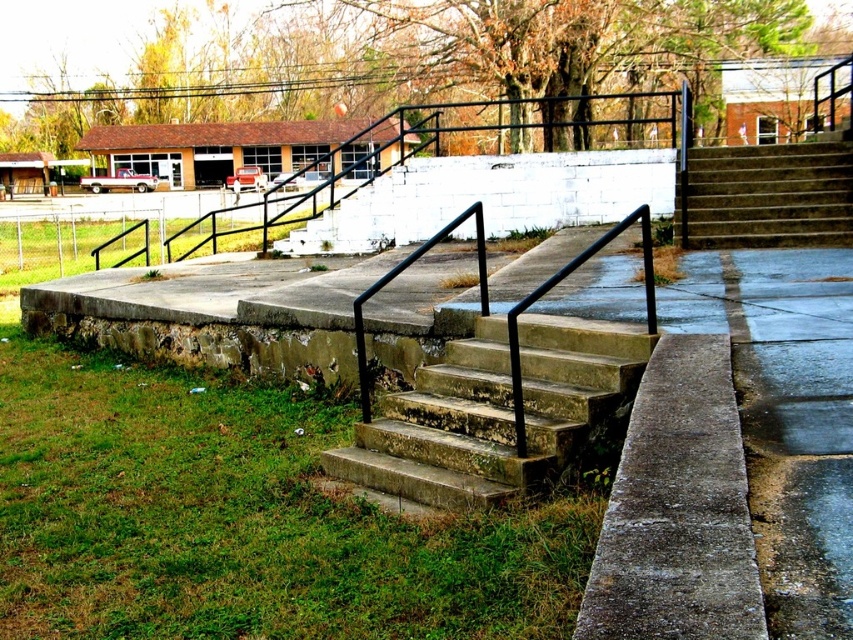
Question: Does concrete steps at center come in front of brown concrete stairs at upper right?

Choices:
 (A) no
 (B) yes

Answer: (B)

Question: Which point appears farthest from the camera in this image?

Choices:
 (A) (813, 227)
 (B) (408, 209)
 (C) (172, 518)
 (D) (492, 394)

Answer: (B)

Question: Does black metal railing at upper center appear over brown concrete stairs at upper right?

Choices:
 (A) yes
 (B) no

Answer: (A)

Question: Among these points, which one is farthest from the camera?

Choices:
 (A) (606, 353)
 (B) (74, 518)
 (C) (558, 128)

Answer: (C)

Question: Which object is farther from the camera taking this photo?

Choices:
 (A) concrete steps at center
 (B) black metal railing at upper center

Answer: (B)

Question: Is green grass at lower left positioned behind brown concrete stairs at upper right?

Choices:
 (A) no
 (B) yes

Answer: (A)